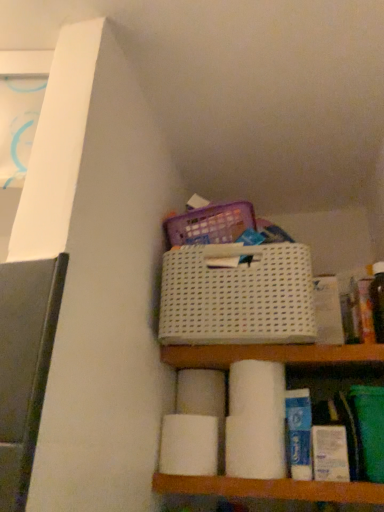
Question: Is white matte toilet paper at center, the 2th toilet paper from the front, further to camera compared to white mesh basket at center?

Choices:
 (A) no
 (B) yes

Answer: (B)

Question: Does white matte toilet paper at center, which is the 2th toilet paper in back-to-front order, have a greater height compared to white mesh basket at center?

Choices:
 (A) no
 (B) yes

Answer: (A)

Question: Is white matte toilet paper at center, the 2th toilet paper from the front, touching white mesh basket at center?

Choices:
 (A) yes
 (B) no

Answer: (B)

Question: Is white mesh basket at center located within white matte toilet paper at center, which is the 2th toilet paper in back-to-front order?

Choices:
 (A) yes
 (B) no

Answer: (B)

Question: Can you confirm if white matte toilet paper at center, the 2th toilet paper from the front, is positioned to the right of white mesh basket at center?

Choices:
 (A) no
 (B) yes

Answer: (A)

Question: Is white matte toilet paper at center, the 2th toilet paper from the front, located outside white mesh basket at center?

Choices:
 (A) no
 (B) yes

Answer: (B)

Question: Does white matte toilet paper at center, which is the third toilet paper in back-to-front order, appear on the left side of white matte toilet paper at lower center, the third toilet paper when ordered from front to back?

Choices:
 (A) yes
 (B) no

Answer: (B)

Question: From a real-world perspective, does white matte toilet paper at center, the first toilet paper when ordered from front to back, sit lower than white matte toilet paper at lower center, arranged as the first toilet paper when viewed from the back?

Choices:
 (A) yes
 (B) no

Answer: (A)

Question: Does white matte toilet paper at center, the first toilet paper when ordered from front to back, have a lesser width compared to white matte toilet paper at lower center, arranged as the first toilet paper when viewed from the back?

Choices:
 (A) no
 (B) yes

Answer: (B)

Question: Could you tell me if white matte toilet paper at center, the first toilet paper when ordered from front to back, is turned towards white matte toilet paper at lower center, the third toilet paper when ordered from front to back?

Choices:
 (A) no
 (B) yes

Answer: (A)

Question: Is white matte toilet paper at center, which is the third toilet paper in back-to-front order, positioned behind white matte toilet paper at lower center, arranged as the first toilet paper when viewed from the back?

Choices:
 (A) no
 (B) yes

Answer: (A)

Question: Is the surface of white matte toilet paper at center, which is the third toilet paper in back-to-front order, in direct contact with white matte toilet paper at lower center, the third toilet paper when ordered from front to back?

Choices:
 (A) no
 (B) yes

Answer: (A)

Question: Does white matte toilet paper at center, which is the third toilet paper in back-to-front order, have a larger size compared to white matte toilet paper at center, the 2th toilet paper from the front?

Choices:
 (A) yes
 (B) no

Answer: (B)